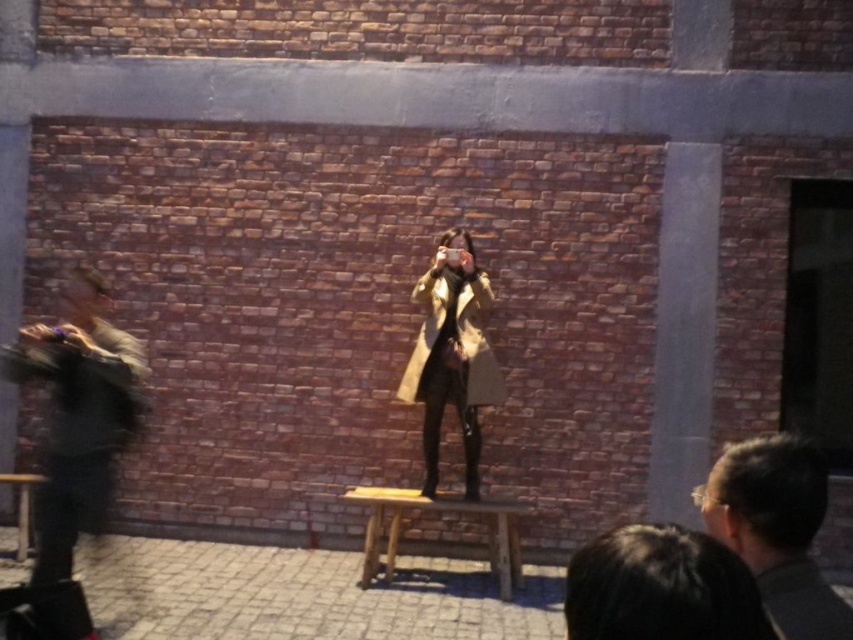
Question: Does dark gray fur coat at left have a larger size compared to dark brown hair at center?

Choices:
 (A) yes
 (B) no

Answer: (A)

Question: Observing the image, what is the correct spatial positioning of dark gray fur coat at left in reference to dark brown hair at center?

Choices:
 (A) below
 (B) above

Answer: (A)

Question: Which of the following is the farthest from the observer?

Choices:
 (A) dark gray fur coat at left
 (B) dark brown hair at center

Answer: (A)

Question: Can you confirm if dark gray fur coat at left is bigger than dark brown hair at center?

Choices:
 (A) yes
 (B) no

Answer: (A)

Question: Which point is farther from the camera taking this photo?

Choices:
 (A) (798, 451)
 (B) (68, 348)

Answer: (B)